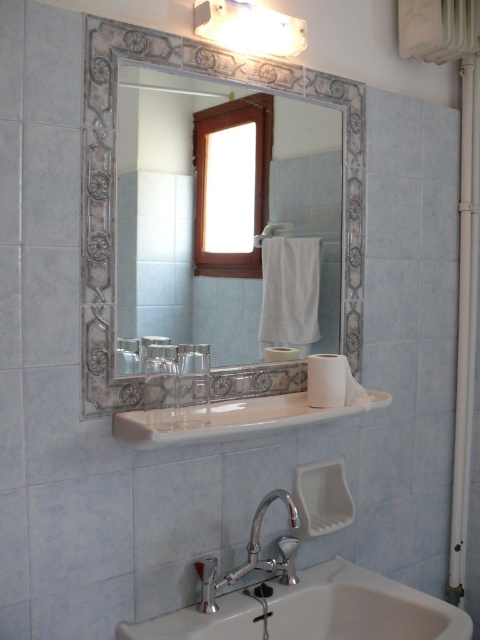
Question: Which is farther from the white glossy sink at center?

Choices:
 (A) polished chrome faucet at lower center
 (B) white fabric towel bar at center

Answer: (B)

Question: Which object appears farthest from the camera in this image?

Choices:
 (A) white glossy sink at center
 (B) polished chrome faucet at lower center
 (C) white ceramic sink at lower center

Answer: (B)

Question: Does white ceramic sink at lower center come behind white glossy light fixture at upper center?

Choices:
 (A) no
 (B) yes

Answer: (A)

Question: Is polished chrome faucet at lower center wider than white fabric towel bar at center?

Choices:
 (A) yes
 (B) no

Answer: (A)

Question: Which object appears farthest from the camera in this image?

Choices:
 (A) silver metallic mirror at upper center
 (B) white glossy sink at center
 (C) white fabric towel bar at center
 (D) white glossy light fixture at upper center

Answer: (C)

Question: Is silver metallic mirror at upper center positioned behind white glossy sink at center?

Choices:
 (A) yes
 (B) no

Answer: (A)